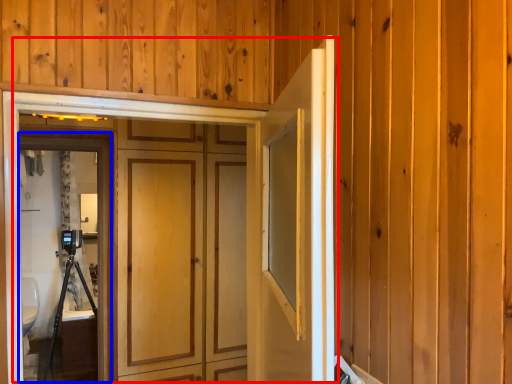
Question: Among these objects, which one is nearest to the camera, door (highlighted by a red box) or screen door (highlighted by a blue box)?

Choices:
 (A) door
 (B) screen door

Answer: (A)